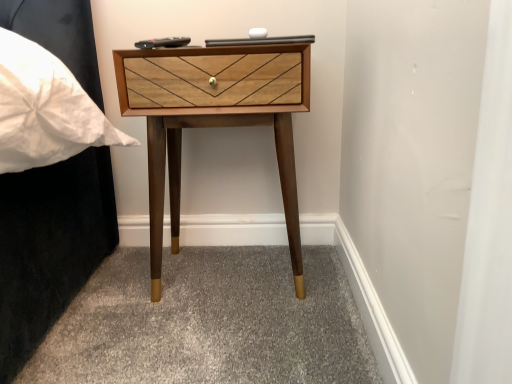
Question: Should I look upward or downward to see wooden nightstand at center?

Choices:
 (A) down
 (B) up

Answer: (B)